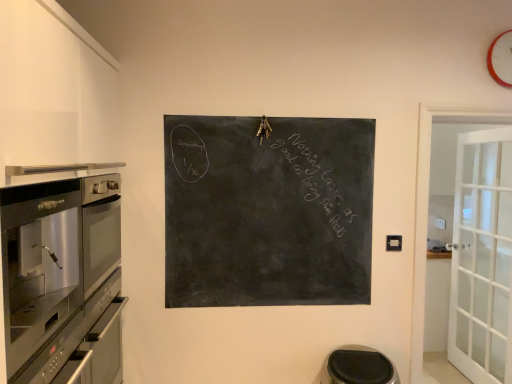
Question: Should I look upward or downward to see black rubber step stool at lower center?

Choices:
 (A) down
 (B) up

Answer: (A)

Question: Does stainless steel oven at left have a lesser width compared to orange plastic clock at upper right?

Choices:
 (A) yes
 (B) no

Answer: (B)

Question: Is stainless steel oven at left bigger than orange plastic clock at upper right?

Choices:
 (A) yes
 (B) no

Answer: (A)

Question: From the image's perspective, is stainless steel oven at left over orange plastic clock at upper right?

Choices:
 (A) no
 (B) yes

Answer: (A)

Question: Considering the relative positions of stainless steel oven at left and orange plastic clock at upper right in the image provided, is stainless steel oven at left behind orange plastic clock at upper right?

Choices:
 (A) no
 (B) yes

Answer: (A)

Question: Does stainless steel oven at left turn towards orange plastic clock at upper right?

Choices:
 (A) yes
 (B) no

Answer: (A)

Question: Is stainless steel oven at left at the right side of orange plastic clock at upper right?

Choices:
 (A) yes
 (B) no

Answer: (B)

Question: From a real-world perspective, is orange plastic clock at upper right over black chalkboard at center?

Choices:
 (A) no
 (B) yes

Answer: (B)

Question: Does orange plastic clock at upper right have a greater width compared to black chalkboard at center?

Choices:
 (A) no
 (B) yes

Answer: (A)

Question: Does orange plastic clock at upper right have a lesser height compared to black chalkboard at center?

Choices:
 (A) yes
 (B) no

Answer: (A)

Question: Is orange plastic clock at upper right positioned beyond the bounds of black chalkboard at center?

Choices:
 (A) no
 (B) yes

Answer: (B)

Question: Is orange plastic clock at upper right taller than black chalkboard at center?

Choices:
 (A) yes
 (B) no

Answer: (B)

Question: Is black chalkboard at center at the back of orange plastic clock at upper right?

Choices:
 (A) yes
 (B) no

Answer: (B)

Question: Considering the relative positions of black rubber step stool at lower center and black chalkboard at center in the image provided, is black rubber step stool at lower center to the left of black chalkboard at center from the viewer's perspective?

Choices:
 (A) no
 (B) yes

Answer: (A)